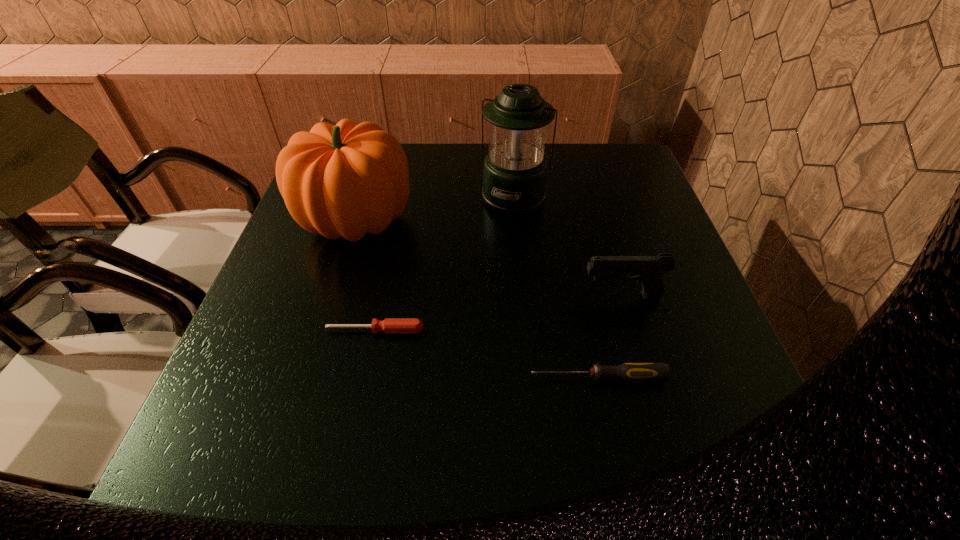
Identify the location of screwdriver that is at the left edge. (389, 326).

This screenshot has width=960, height=540. Find the location of `pistol positioned at the right edge`. pistol positioned at the right edge is located at coordinates (648, 269).

You are a GUI agent. You are given a task and a screenshot of the screen. Output one action in this format:
    pyautogui.click(x=<x>, y=<y>)
    Task: Click on the screwdriver present at the right edge
    This screenshot has width=960, height=540.
    Given the screenshot: What is the action you would take?
    pyautogui.click(x=629, y=372)

Find the location of a particular element. Image resolution: width=960 pixels, height=540 pixels. object located in the far left corner section of the desktop is located at coordinates (347, 180).

This screenshot has width=960, height=540. In order to click on free space at the far edge of the desktop in this screenshot , I will do `click(410, 151)`.

In the image, there is a desktop. Where is `vacant area at the near edge`? vacant area at the near edge is located at coordinates (655, 455).

In the image, there is a desktop. Where is `free space at the left edge`? free space at the left edge is located at coordinates (208, 408).

Locate an element on the screen. This screenshot has height=540, width=960. free space at the right edge of the desktop is located at coordinates (613, 250).

Identify the location of free location at the far right corner. This screenshot has width=960, height=540. (587, 148).

At what (x,y) coordinates should I click in order to perform the action: click on free spot at the near right corner of the desktop. Please return your answer as a coordinate pair (x, y). The width and height of the screenshot is (960, 540). Looking at the image, I should click on (679, 482).